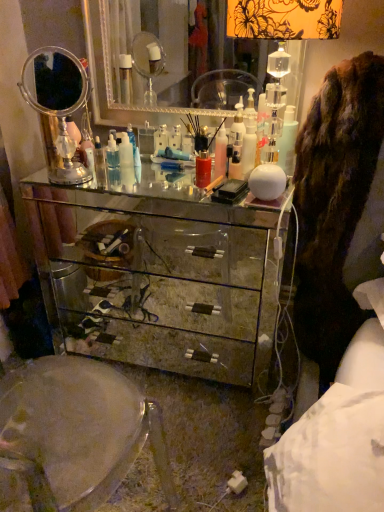
Question: Which direction should I rotate to face silver mirrored dresser at center, the 1th mirror viewed from the right, — up or down?

Choices:
 (A) down
 (B) up

Answer: (B)

Question: Is translucent glass lampshade at upper right oriented towards mirrored glass chest of drawers at center?

Choices:
 (A) no
 (B) yes

Answer: (A)

Question: From a real-world perspective, is translucent glass lampshade at upper right physically below mirrored glass chest of drawers at center?

Choices:
 (A) no
 (B) yes

Answer: (A)

Question: Does translucent glass lampshade at upper right lie in front of mirrored glass chest of drawers at center?

Choices:
 (A) no
 (B) yes

Answer: (B)

Question: Does translucent glass lampshade at upper right have a greater height compared to mirrored glass chest of drawers at center?

Choices:
 (A) no
 (B) yes

Answer: (A)

Question: Are translucent glass lampshade at upper right and mirrored glass chest of drawers at center making contact?

Choices:
 (A) no
 (B) yes

Answer: (A)

Question: Does translucent glass lampshade at upper right appear on the left side of mirrored glass chest of drawers at center?

Choices:
 (A) no
 (B) yes

Answer: (A)

Question: Can you confirm if clear plastic bottle at center, which is the 2th toiletry from right to left, is thinner than brown furry coat at right?

Choices:
 (A) no
 (B) yes

Answer: (B)

Question: Does clear plastic bottle at center, marked as the first toiletry in a left-to-right arrangement, have a larger size compared to brown furry coat at right?

Choices:
 (A) no
 (B) yes

Answer: (A)

Question: Is clear plastic bottle at center, placed as the 2th toiletry when sorted from front to back, to the right of brown furry coat at right from the viewer's perspective?

Choices:
 (A) no
 (B) yes

Answer: (A)

Question: Is clear plastic bottle at center, marked as the first toiletry in a left-to-right arrangement, aimed at brown furry coat at right?

Choices:
 (A) no
 (B) yes

Answer: (A)

Question: Does clear plastic bottle at center, marked as the first toiletry in a left-to-right arrangement, have a smaller size compared to brown furry coat at right?

Choices:
 (A) yes
 (B) no

Answer: (A)

Question: Considering the relative positions of clear plastic bottle at center, which is the 2th toiletry from right to left, and brown furry coat at right in the image provided, is clear plastic bottle at center, which is the 2th toiletry from right to left, behind brown furry coat at right?

Choices:
 (A) yes
 (B) no

Answer: (A)

Question: Is brown furry coat at right to the right of translucent plastic bottle at center, the 2th toiletry when ordered from left to right, from the viewer's perspective?

Choices:
 (A) yes
 (B) no

Answer: (A)